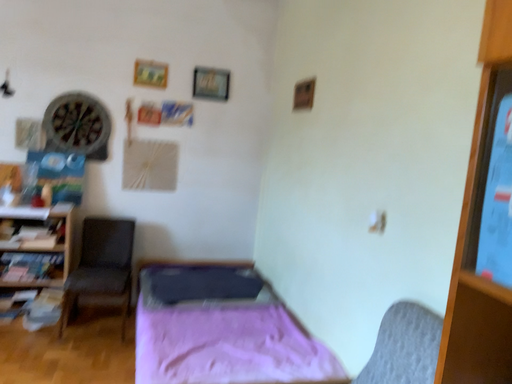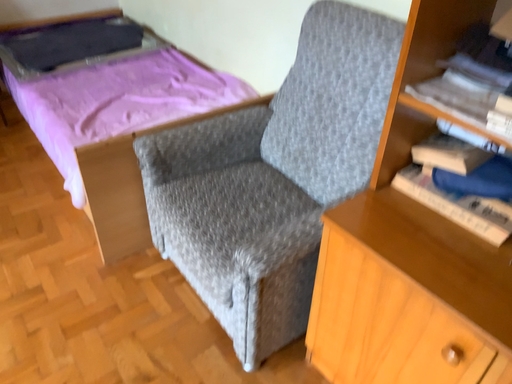
Question: How did the camera likely rotate when shooting the video?

Choices:
 (A) rotated upward
 (B) rotated downward

Answer: (B)